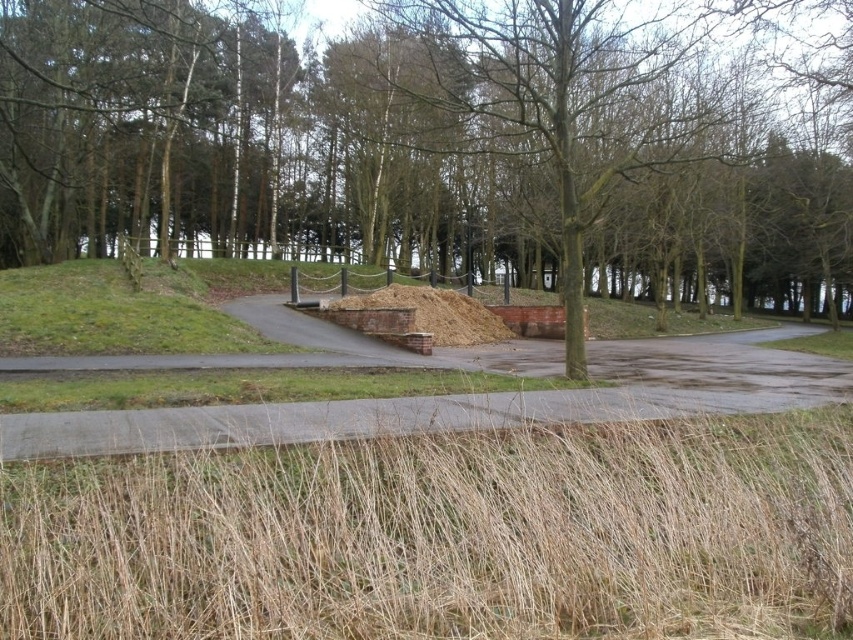
Question: Which point is closer to the camera?

Choices:
 (A) dry grass at lower center
 (B) brown woodpile at center
 (C) brown bark tree at center

Answer: (A)

Question: Which of the following is the closest to the observer?

Choices:
 (A) brown bark tree at center
 (B) brown woodpile at center
 (C) dry grass at lower center

Answer: (C)

Question: Can you confirm if dry grass at lower center is positioned to the left of brown woodpile at center?

Choices:
 (A) yes
 (B) no

Answer: (B)

Question: Is brown bark tree at center to the left of brown woodpile at center from the viewer's perspective?

Choices:
 (A) yes
 (B) no

Answer: (B)

Question: Which point is closer to the camera?

Choices:
 (A) brown woodpile at center
 (B) brown bark tree at center

Answer: (B)

Question: Can you confirm if dry grass at lower center is positioned to the left of brown woodpile at center?

Choices:
 (A) no
 (B) yes

Answer: (A)